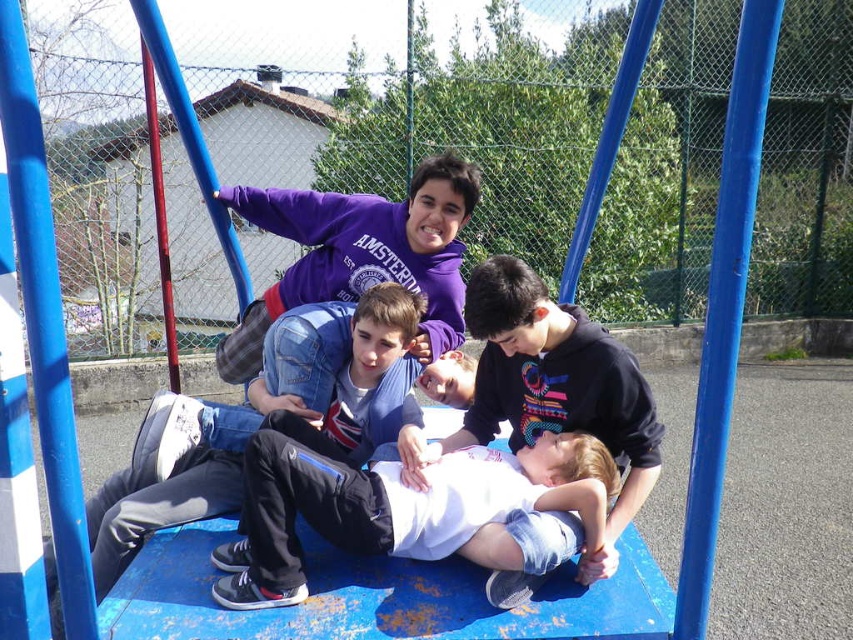
Can you confirm if white cotton shirt at center is taller than denim jacket at center?

No.

What do you see at coordinates (403, 508) in the screenshot?
I see `white cotton shirt at center` at bounding box center [403, 508].

You are a GUI agent. You are given a task and a screenshot of the screen. Output one action in this format:
    pyautogui.click(x=<x>, y=<y>)
    Task: Click on the white cotton shirt at center
    This screenshot has width=853, height=640.
    Given the screenshot: What is the action you would take?
    pyautogui.click(x=403, y=508)

Does white matte shirt at center appear on the right side of denim jacket at center?

Yes, white matte shirt at center is to the right of denim jacket at center.

Between point (491, 392) and point (280, 344), which one is positioned behind?

The point (280, 344) is more distant.

Where is `white matte shirt at center`? The height and width of the screenshot is (640, 853). white matte shirt at center is located at coordinates (554, 380).

Is white cotton shirt at center closer to the viewer compared to white matte shirt at center?

Yes, white cotton shirt at center is in front of white matte shirt at center.

Does white cotton shirt at center have a lesser height compared to white matte shirt at center?

Indeed, white cotton shirt at center has a lesser height compared to white matte shirt at center.

Find the location of a particular element. The width and height of the screenshot is (853, 640). white cotton shirt at center is located at coordinates (403, 508).

At what (x,y) coordinates should I click in order to perform the action: click on white cotton shirt at center. Please return your answer as a coordinate pair (x, y). Looking at the image, I should click on (403, 508).